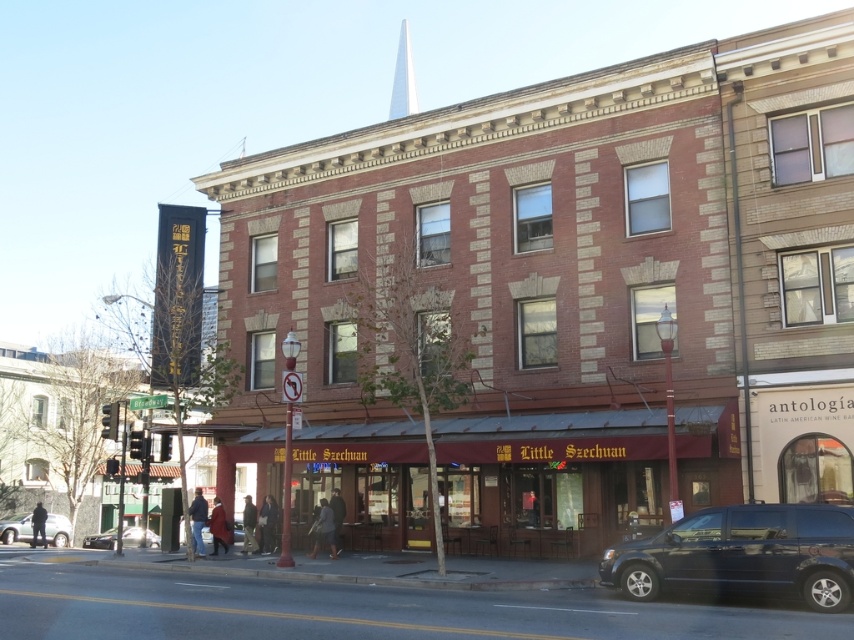
Where is `shiny black van at lower right`? The width and height of the screenshot is (854, 640). shiny black van at lower right is located at coordinates (743, 552).

Is point (752, 564) farther from viewer compared to point (61, 547)?

No, it is not.

Locate an element on the screen. shiny black van at lower right is located at coordinates (743, 552).

Is white smooth spire at upper center positioned before silver metallic sedan at lower left?

No, it is not.

Can you confirm if white smooth spire at upper center is positioned above silver metallic sedan at lower left?

Yes, white smooth spire at upper center is above silver metallic sedan at lower left.

Between point (410, 106) and point (1, 536), which one is positioned in front?

Point (1, 536)

Identify the location of white smooth spire at upper center. The image size is (854, 640). (402, 77).

Can you confirm if shiny black van at lower right is taller than white smooth spire at upper center?

Incorrect, shiny black van at lower right's height is not larger of white smooth spire at upper center's.

Between shiny black van at lower right and white smooth spire at upper center, which one has less height?

shiny black van at lower right

The height and width of the screenshot is (640, 854). I want to click on shiny black van at lower right, so (x=743, y=552).